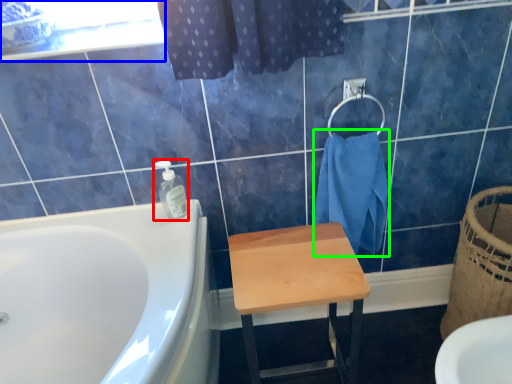
Question: Which is farther away from soap dispenser (highlighted by a red box)? window screen (highlighted by a blue box) or bath towel (highlighted by a green box)?

Choices:
 (A) window screen
 (B) bath towel

Answer: (B)